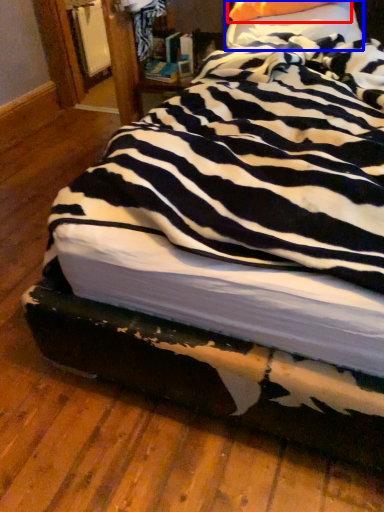
Question: Which object appears farthest to the camera in this image, pillow (highlighted by a red box) or pillow (highlighted by a blue box)?

Choices:
 (A) pillow
 (B) pillow

Answer: (A)